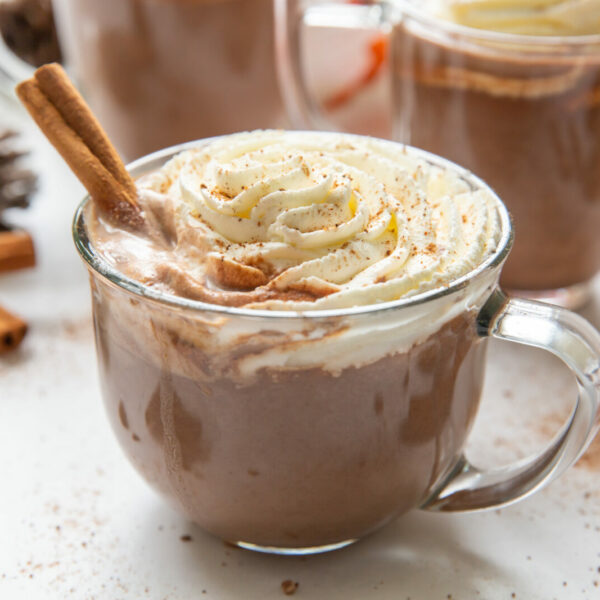
The image size is (600, 600). What are the coordinates of `handle` in the screenshot? It's located at (23, 60).